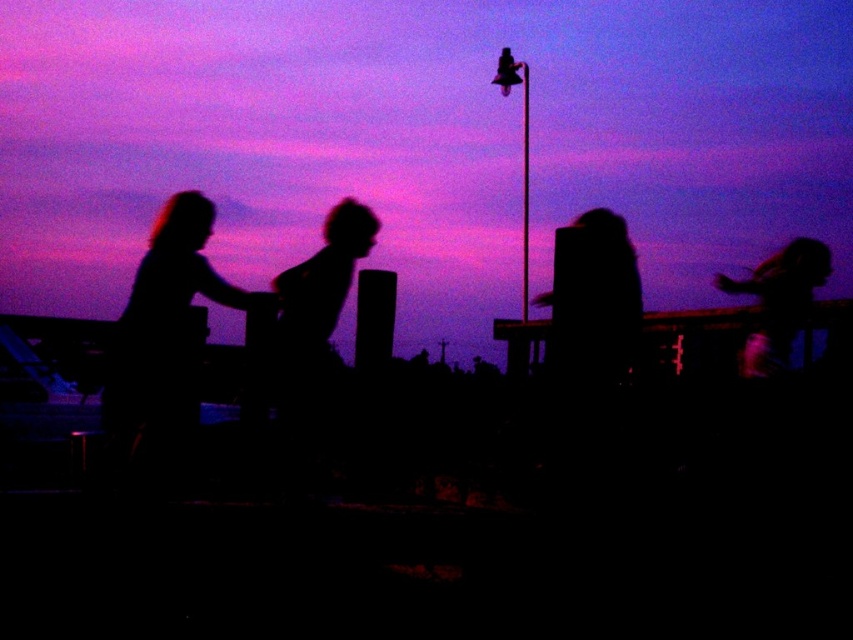
Does silhouette hair at left appear on the left side of silhouette hair at upper right?

Indeed, silhouette hair at left is positioned on the left side of silhouette hair at upper right.

Who is shorter, silhouette hair at left or silhouette hair at upper right?

silhouette hair at upper right is shorter.

Who is more forward, [228,294] or [811,294]?

Point [228,294] is more forward.

Image resolution: width=853 pixels, height=640 pixels. I want to click on silhouette hair at left, so click(161, 340).